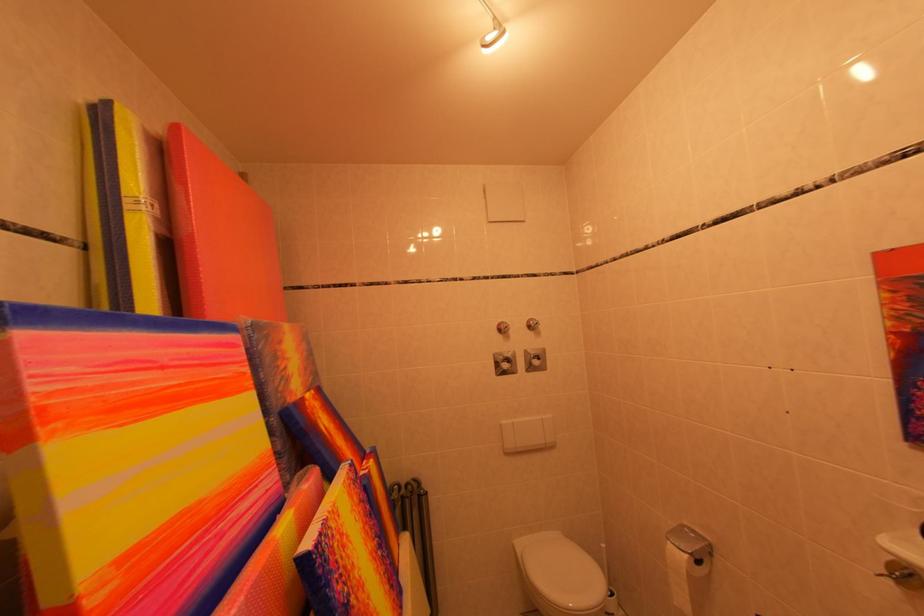
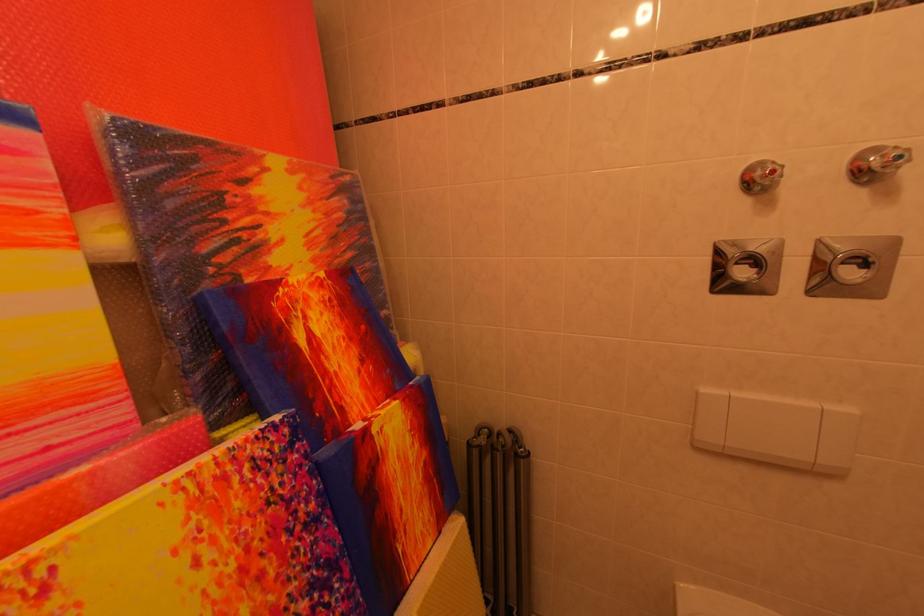
In the second image, find the point that corresponds to (x=516, y=331) in the first image.

(782, 176)